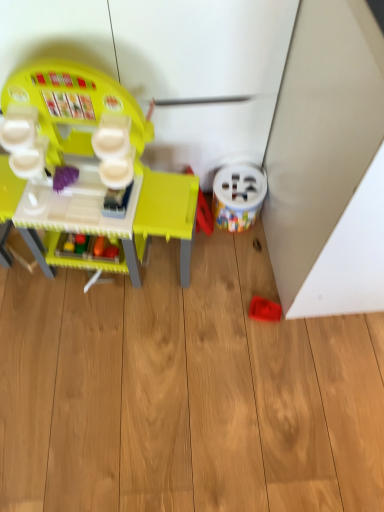
Locate an element on the screen. This screenshot has width=384, height=512. matte plastic play kitchen at left, placed as the first toy when sorted from left to right is located at coordinates (87, 168).

The height and width of the screenshot is (512, 384). Find the location of `rubberized red toy at lower right, which appears as the 1th toy when viewed from the right`. rubberized red toy at lower right, which appears as the 1th toy when viewed from the right is located at coordinates (264, 310).

Locate an element on the screen. This screenshot has width=384, height=512. matte plastic play kitchen at left, positioned as the third toy in right-to-left order is located at coordinates (87, 168).

Would you say matte plastic play kitchen at left, placed as the first toy when sorted from left to right, is inside or outside rubberized red toy at lower right, the 3th toy from the left?

matte plastic play kitchen at left, placed as the first toy when sorted from left to right, is located beyond the bounds of rubberized red toy at lower right, the 3th toy from the left.

From a real-world perspective, count 2nd toys downward from the matte plastic play kitchen at left, positioned as the third toy in right-to-left order, and point to it. Please provide its 2D coordinates.

[(264, 310)]

Between matte plastic play kitchen at left, positioned as the third toy in right-to-left order, and rubberized red toy at lower right, which appears as the 1th toy when viewed from the right, which one appears on the left side from the viewer's perspective?

Positioned to the left is matte plastic play kitchen at left, positioned as the third toy in right-to-left order.

You are a GUI agent. You are given a task and a screenshot of the screen. Output one action in this format:
    pyautogui.click(x=<x>, y=<y>)
    Task: Click on the toy on the left of white plastic bucket at lower right, the second toy viewed from the right
    The width and height of the screenshot is (384, 512).
    Given the screenshot: What is the action you would take?
    pyautogui.click(x=87, y=168)

From a real-world perspective, between white plastic bucket at lower right, the 2th toy when ordered from left to right, and matte plastic play kitchen at left, positioned as the third toy in right-to-left order, who is vertically higher?

matte plastic play kitchen at left, positioned as the third toy in right-to-left order, is physically above.

Does white plastic bucket at lower right, the 2th toy when ordered from left to right, lie behind matte plastic play kitchen at left, placed as the first toy when sorted from left to right?

Yes, white plastic bucket at lower right, the 2th toy when ordered from left to right, is further from the viewer.

Consider the image. From a real-world perspective, is rubberized red toy at lower right, the 3th toy from the left, beneath white plastic bucket at lower right, the 2th toy when ordered from left to right?

Yes, from a real-world perspective, rubberized red toy at lower right, the 3th toy from the left, is under white plastic bucket at lower right, the 2th toy when ordered from left to right.

Does point (262, 306) lie in front of point (237, 231)?

Yes.

Can we say rubberized red toy at lower right, the 3th toy from the left, lies outside white plastic bucket at lower right, the 2th toy when ordered from left to right?

rubberized red toy at lower right, the 3th toy from the left, lies outside white plastic bucket at lower right, the 2th toy when ordered from left to right,'s area.

Is rubberized red toy at lower right, the 3th toy from the left, at the back of white plastic bucket at lower right, the second toy viewed from the right?

white plastic bucket at lower right, the second toy viewed from the right, is not turned away from rubberized red toy at lower right, the 3th toy from the left.

In the scene shown: Can we say white plastic bucket at lower right, the second toy viewed from the right, lies outside rubberized red toy at lower right, the 3th toy from the left?

That's correct, white plastic bucket at lower right, the second toy viewed from the right, is outside of rubberized red toy at lower right, the 3th toy from the left.

Does white plastic bucket at lower right, the 2th toy when ordered from left to right, lie behind rubberized red toy at lower right, which appears as the 1th toy when viewed from the right?

No, white plastic bucket at lower right, the 2th toy when ordered from left to right, is closer to the viewer.

Is the surface of white plastic bucket at lower right, the second toy viewed from the right, in direct contact with rubberized red toy at lower right, the 3th toy from the left?

No, white plastic bucket at lower right, the second toy viewed from the right, is not touching rubberized red toy at lower right, the 3th toy from the left.

Does matte plastic play kitchen at left, placed as the first toy when sorted from left to right, have a lesser width compared to white plastic bucket at lower right, the 2th toy when ordered from left to right?

No, matte plastic play kitchen at left, placed as the first toy when sorted from left to right, is not thinner than white plastic bucket at lower right, the 2th toy when ordered from left to right.

Considering the positions of objects matte plastic play kitchen at left, placed as the first toy when sorted from left to right, and white plastic bucket at lower right, the second toy viewed from the right, in the image provided, who is more to the left, matte plastic play kitchen at left, placed as the first toy when sorted from left to right, or white plastic bucket at lower right, the second toy viewed from the right,?

Positioned to the left is matte plastic play kitchen at left, placed as the first toy when sorted from left to right.

Is point (138, 122) in front of point (219, 175)?

Yes, it is in front of point (219, 175).

Between matte plastic play kitchen at left, positioned as the third toy in right-to-left order, and white plastic bucket at lower right, the second toy viewed from the right, which one has more height?

matte plastic play kitchen at left, positioned as the third toy in right-to-left order, is taller.

Is point (266, 306) more distant than point (163, 196)?

Yes.

Consider the image. From the image's perspective, does rubberized red toy at lower right, which appears as the 1th toy when viewed from the right, appear lower than matte plastic play kitchen at left, positioned as the third toy in right-to-left order?

Correct, rubberized red toy at lower right, which appears as the 1th toy when viewed from the right, appears lower than matte plastic play kitchen at left, positioned as the third toy in right-to-left order, in the image.

Which of these two, rubberized red toy at lower right, which appears as the 1th toy when viewed from the right, or matte plastic play kitchen at left, positioned as the third toy in right-to-left order, is wider?

Wider between the two is matte plastic play kitchen at left, positioned as the third toy in right-to-left order.

Based on their positions, is rubberized red toy at lower right, which appears as the 1th toy when viewed from the right, located to the left or right of matte plastic play kitchen at left, placed as the first toy when sorted from left to right?

From the image, it's evident that rubberized red toy at lower right, which appears as the 1th toy when viewed from the right, is to the right of matte plastic play kitchen at left, placed as the first toy when sorted from left to right.

Where is `toy that is the 2nd one below the matte plastic play kitchen at left, positioned as the third toy in right-to-left order (from a real-world perspective)`? The width and height of the screenshot is (384, 512). toy that is the 2nd one below the matte plastic play kitchen at left, positioned as the third toy in right-to-left order (from a real-world perspective) is located at coordinates (264, 310).

Locate an element on the screen. The width and height of the screenshot is (384, 512). toy on the left of white plastic bucket at lower right, the 2th toy when ordered from left to right is located at coordinates tap(87, 168).

Looking at the image, which one is located closer to matte plastic play kitchen at left, positioned as the third toy in right-to-left order, white plastic bucket at lower right, the 2th toy when ordered from left to right, or rubberized red toy at lower right, which appears as the 1th toy when viewed from the right?

white plastic bucket at lower right, the 2th toy when ordered from left to right, lies closer to matte plastic play kitchen at left, positioned as the third toy in right-to-left order, than the other object.

Looking at the image, which one is located further to white plastic bucket at lower right, the second toy viewed from the right, matte plastic play kitchen at left, positioned as the third toy in right-to-left order, or rubberized red toy at lower right, which appears as the 1th toy when viewed from the right?

matte plastic play kitchen at left, positioned as the third toy in right-to-left order, is positioned further to the anchor white plastic bucket at lower right, the second toy viewed from the right.

Considering their positions, is rubberized red toy at lower right, which appears as the 1th toy when viewed from the right, positioned closer to white plastic bucket at lower right, the 2th toy when ordered from left to right, than matte plastic play kitchen at left, placed as the first toy when sorted from left to right?

Based on the image, rubberized red toy at lower right, which appears as the 1th toy when viewed from the right, appears to be nearer to white plastic bucket at lower right, the 2th toy when ordered from left to right.

Looking at the image, which one is located further to matte plastic play kitchen at left, placed as the first toy when sorted from left to right, rubberized red toy at lower right, which appears as the 1th toy when viewed from the right, or white plastic bucket at lower right, the 2th toy when ordered from left to right?

rubberized red toy at lower right, which appears as the 1th toy when viewed from the right, is further to matte plastic play kitchen at left, placed as the first toy when sorted from left to right.

Estimate the real-world distances between objects in this image. Which object is further from rubberized red toy at lower right, which appears as the 1th toy when viewed from the right, matte plastic play kitchen at left, placed as the first toy when sorted from left to right, or white plastic bucket at lower right, the 2th toy when ordered from left to right?

matte plastic play kitchen at left, placed as the first toy when sorted from left to right, lies further to rubberized red toy at lower right, which appears as the 1th toy when viewed from the right, than the other object.

When comparing their distances from rubberized red toy at lower right, which appears as the 1th toy when viewed from the right, does white plastic bucket at lower right, the second toy viewed from the right, or matte plastic play kitchen at left, placed as the first toy when sorted from left to right, seem further?

matte plastic play kitchen at left, placed as the first toy when sorted from left to right, lies further to rubberized red toy at lower right, which appears as the 1th toy when viewed from the right, than the other object.

The image size is (384, 512). Find the location of `toy positioned between matte plastic play kitchen at left, positioned as the third toy in right-to-left order, and rubberized red toy at lower right, which appears as the 1th toy when viewed from the right, from near to far`. toy positioned between matte plastic play kitchen at left, positioned as the third toy in right-to-left order, and rubberized red toy at lower right, which appears as the 1th toy when viewed from the right, from near to far is located at coordinates click(x=238, y=196).